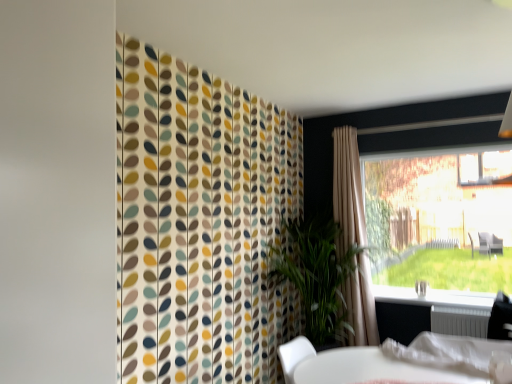
Question: Choose the correct answer: Is beige fabric curtain at right inside transparent glass window at right or outside it?

Choices:
 (A) outside
 (B) inside

Answer: (A)

Question: From the image's perspective, is beige fabric curtain at right above or below transparent glass window at right?

Choices:
 (A) below
 (B) above

Answer: (A)

Question: Which of these objects is positioned farthest from the white plastic bag at lower right?

Choices:
 (A) transparent glass window at right
 (B) white metallic radiator at lower right
 (C) white plastic window sill at lower right
 (D) beige fabric curtain at right
 (E) green leafy plant at center

Answer: (A)

Question: Considering the real-world distances, which object is closest to the white plastic window sill at lower right?

Choices:
 (A) transparent glass window at right
 (B) white plastic bag at lower right
 (C) beige fabric curtain at right
 (D) green leafy plant at center
 (E) white metallic radiator at lower right

Answer: (E)